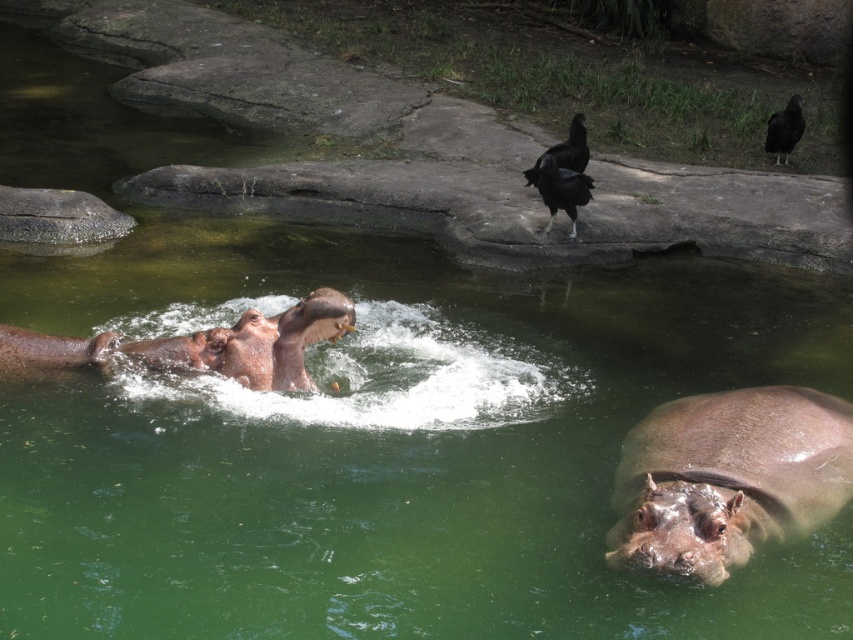
Where is `brown matte hippo at center`? brown matte hippo at center is located at coordinates (202, 346).

Which is more to the left, brown matte hippo at center or black glossy bird at upper center?

Positioned to the left is brown matte hippo at center.

Locate an element on the screen. This screenshot has width=853, height=640. brown matte hippo at center is located at coordinates (202, 346).

Where is `brown matte hippo at center`? brown matte hippo at center is located at coordinates (202, 346).

Who is positioned more to the left, black glossy bird at upper center or black glossy bird at upper right?

From the viewer's perspective, black glossy bird at upper center appears more on the left side.

Does black glossy bird at upper center have a greater width compared to black glossy bird at upper right?

Yes, black glossy bird at upper center is wider than black glossy bird at upper right.

Between point (560, 200) and point (787, 161), which one is positioned in front?

Point (560, 200)

Locate an element on the screen. Image resolution: width=853 pixels, height=640 pixels. black glossy bird at upper center is located at coordinates (560, 188).

Who is positioned more to the left, smokey brown skin at center or gray rough rock at upper left?

gray rough rock at upper left

Identify the location of smokey brown skin at center. Image resolution: width=853 pixels, height=640 pixels. (728, 477).

Is point (653, 541) closer to viewer compared to point (90, 211)?

Yes, point (653, 541) is in front of point (90, 211).

Locate an element on the screen. The image size is (853, 640). smokey brown skin at center is located at coordinates (728, 477).